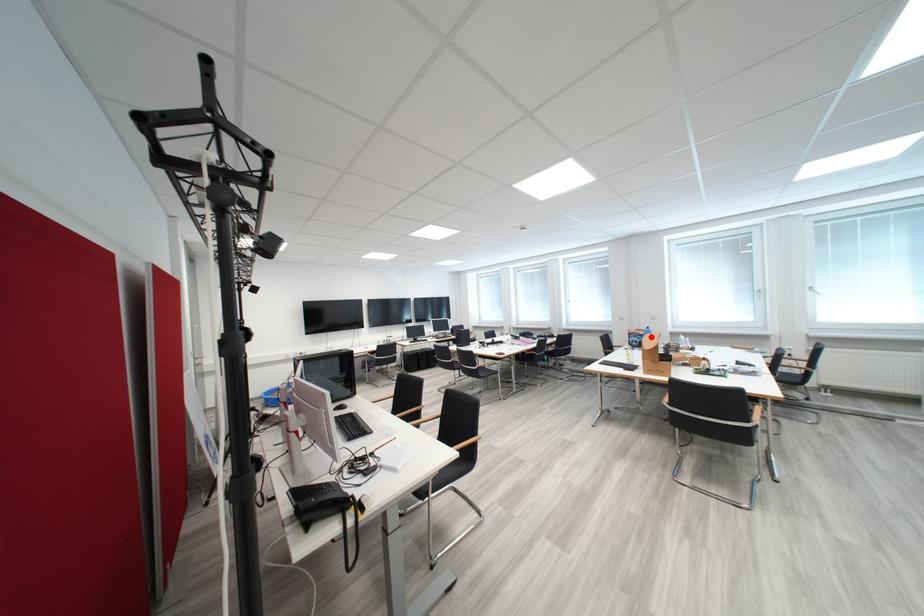
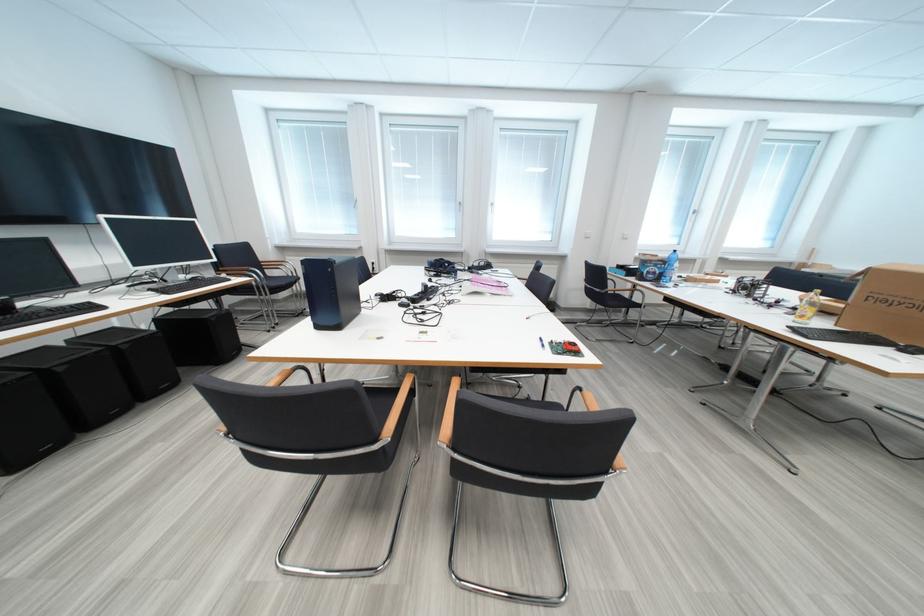
Where in the second image is the point corresponding to the highlighted location from the first image?

(675, 265)